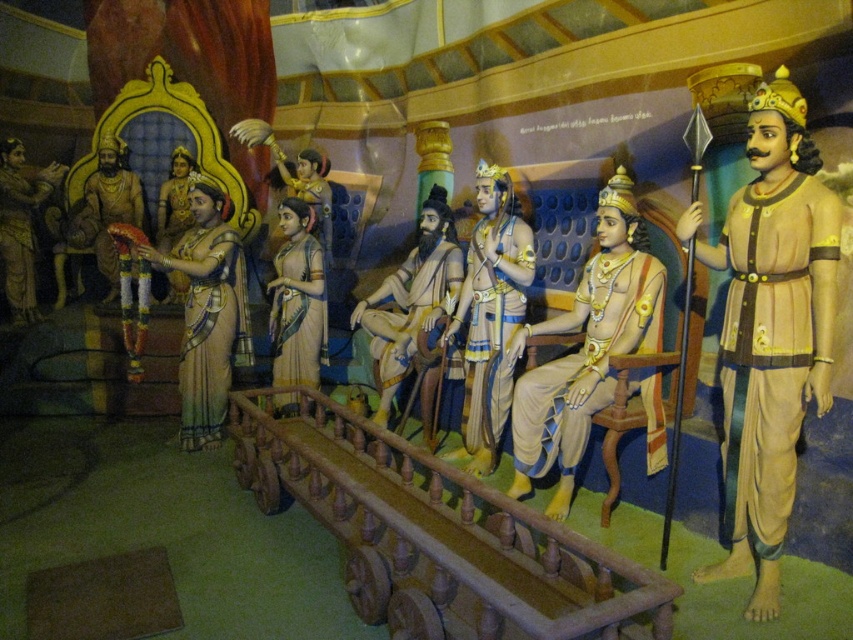
Looking at this image, you are standing in the royal court and want to place a small offering on the closest point between point (544, 624) and point (735, 486). Which point should you aim for?

You should aim for point (544, 624) because it is closer to the camera than point (735, 486).

You are an artist trying to draw the scene. You need to ensure the proportions are correct. Which object should you draw larger in size between the smooth beige robe at center and the matte gold crown at center?

The smooth beige robe at center should be drawn larger than the matte gold crown at center because it is taller according to the description.